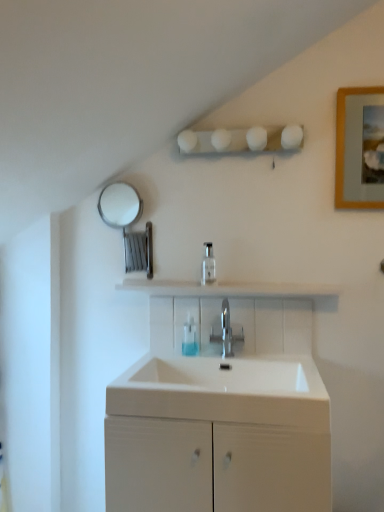
Question: Should I look upward or downward to see translucent plastic soap dispenser at center?

Choices:
 (A) down
 (B) up

Answer: (A)

Question: Considering the relative positions of polished metallic tap at center and translucent plastic soap dispenser at center in the image provided, is polished metallic tap at center to the right of translucent plastic soap dispenser at center from the viewer's perspective?

Choices:
 (A) yes
 (B) no

Answer: (A)

Question: From the image's perspective, is polished metallic tap at center on top of translucent plastic soap dispenser at center?

Choices:
 (A) no
 (B) yes

Answer: (B)

Question: From the image's perspective, is polished metallic tap at center beneath translucent plastic soap dispenser at center?

Choices:
 (A) yes
 (B) no

Answer: (B)

Question: From a real-world perspective, is polished metallic tap at center on translucent plastic soap dispenser at center?

Choices:
 (A) yes
 (B) no

Answer: (A)

Question: Is polished metallic tap at center with translucent plastic soap dispenser at center?

Choices:
 (A) no
 (B) yes

Answer: (B)

Question: Is polished metallic tap at center to the left of translucent plastic soap dispenser at center from the viewer's perspective?

Choices:
 (A) no
 (B) yes

Answer: (A)

Question: Considering the relative sizes of white glossy shelf at center and white glossy sink at center in the image provided, is white glossy shelf at center taller than white glossy sink at center?

Choices:
 (A) no
 (B) yes

Answer: (A)

Question: Can you confirm if white glossy shelf at center is shorter than white glossy sink at center?

Choices:
 (A) no
 (B) yes

Answer: (B)

Question: Is white glossy shelf at center closer to the viewer compared to white glossy sink at center?

Choices:
 (A) yes
 (B) no

Answer: (B)

Question: Is white glossy shelf at center wider than white glossy sink at center?

Choices:
 (A) no
 (B) yes

Answer: (A)

Question: Can you see white glossy shelf at center touching white glossy sink at center?

Choices:
 (A) yes
 (B) no

Answer: (B)

Question: Is white glossy shelf at center aimed at white glossy sink at center?

Choices:
 (A) no
 (B) yes

Answer: (A)

Question: Is wooden picture frame at upper right smaller than white glossy shelf at center?

Choices:
 (A) no
 (B) yes

Answer: (A)